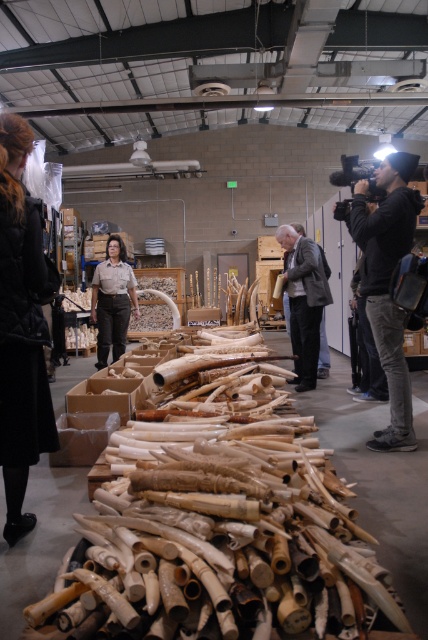
You are a security guard in the warehouse and need to locate the black quilted coat at center and the black hoodie at upper right. Which one is positioned lower in the image?

The black quilted coat at center is below the black hoodie at upper right, so the black quilted coat at center is positioned lower in the image.